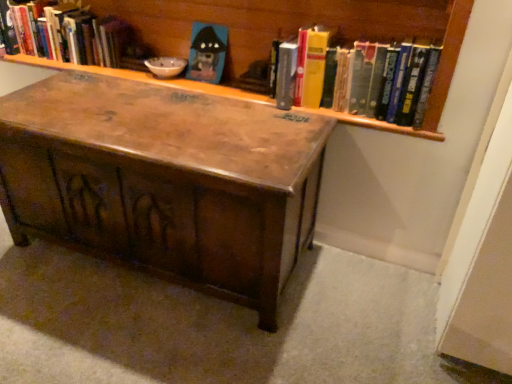
Question: From a real-world perspective, does wooden bookcase at upper center sit lower than hardcover book at upper left, the 2th book viewed from the right?

Choices:
 (A) no
 (B) yes

Answer: (A)

Question: Is the depth of wooden bookcase at upper center less than that of hardcover book at upper left, the 1th book from the back?

Choices:
 (A) yes
 (B) no

Answer: (A)

Question: Considering the relative sizes of wooden bookcase at upper center and hardcover book at upper left, the first book viewed from the left, in the image provided, is wooden bookcase at upper center bigger than hardcover book at upper left, the first book viewed from the left,?

Choices:
 (A) yes
 (B) no

Answer: (A)

Question: Are wooden bookcase at upper center and hardcover book at upper left, the 1th book from the back, far apart?

Choices:
 (A) yes
 (B) no

Answer: (B)

Question: Does wooden bookcase at upper center turn towards hardcover book at upper left, the first book viewed from the left?

Choices:
 (A) no
 (B) yes

Answer: (B)

Question: In terms of size, does hardcover books at upper right, which is counted as the second book, starting from the back, appear bigger or smaller than hardcover book at upper left, the 1th book from the back?

Choices:
 (A) small
 (B) big

Answer: (A)

Question: Do you think hardcover books at upper right, arranged as the first book when viewed from the right, is within hardcover book at upper left, the 2th book viewed from the right, or outside of it?

Choices:
 (A) inside
 (B) outside

Answer: (B)

Question: Considering the positions of point (333, 59) and point (44, 16), is point (333, 59) closer or farther from the camera than point (44, 16)?

Choices:
 (A) farther
 (B) closer

Answer: (B)

Question: In terms of width, does hardcover books at upper right, which is the 2th book from left to right, look wider or thinner when compared to hardcover book at upper left, the first book viewed from the left?

Choices:
 (A) wide
 (B) thin

Answer: (A)

Question: Based on their positions, is hardcover books at upper right, positioned as the first book in front-to-back order, located to the left or right of matte plastic toy at upper center?

Choices:
 (A) left
 (B) right

Answer: (B)

Question: Considering the positions of hardcover books at upper right, arranged as the first book when viewed from the right, and matte plastic toy at upper center in the image, is hardcover books at upper right, arranged as the first book when viewed from the right, taller or shorter than matte plastic toy at upper center?

Choices:
 (A) tall
 (B) short

Answer: (A)

Question: In terms of width, does hardcover books at upper right, which is counted as the second book, starting from the back, look wider or thinner when compared to matte plastic toy at upper center?

Choices:
 (A) wide
 (B) thin

Answer: (A)

Question: Considering the positions of hardcover books at upper right, arranged as the first book when viewed from the right, and matte plastic toy at upper center in the image, is hardcover books at upper right, arranged as the first book when viewed from the right, bigger or smaller than matte plastic toy at upper center?

Choices:
 (A) small
 (B) big

Answer: (B)

Question: In terms of size, does matte plastic toy at upper center appear bigger or smaller than hardcover books at upper right, which is counted as the second book, starting from the back?

Choices:
 (A) small
 (B) big

Answer: (A)

Question: Is matte plastic toy at upper center spatially inside hardcover books at upper right, positioned as the first book in front-to-back order, or outside of it?

Choices:
 (A) inside
 (B) outside

Answer: (B)